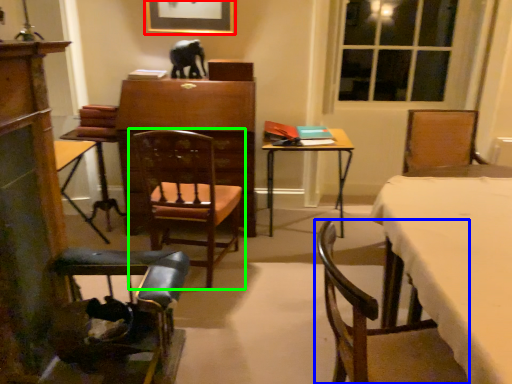
Question: Which is farther away from picture frame (highlighted by a red box)? chair (highlighted by a blue box) or chair (highlighted by a green box)?

Choices:
 (A) chair
 (B) chair

Answer: (A)